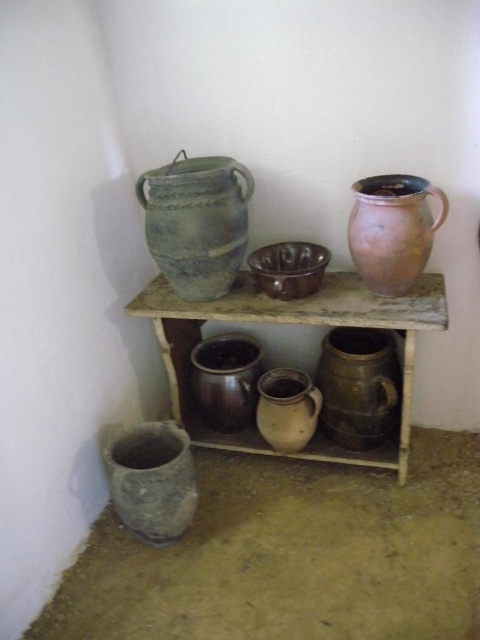
You are standing in front of the rustic corner setup. There is a point marked at coordinates point (385, 404). If you want to place a 1.5 meter long ladder horizontally between you and that point, will it fit without exceeding the space?

The distance between you and the point (385, 404) is 1.80 meters. Since the ladder is 1.5 meters long, it will fit as it is shorter than the available space.

You are standing in front of the rustic corner setup. You want to place a new decorative item on the rustic wood shelf at center. Where exactly should you place it?

The rustic wood shelf at center should be placed at the 2D coordinates point (296, 324).

You are standing in front of the rustic corner setup. You see a point marked at coordinates (359, 387). Which object from the scene is located at this point?

The point at coordinates (359, 387) corresponds to the matte brown jug at center.